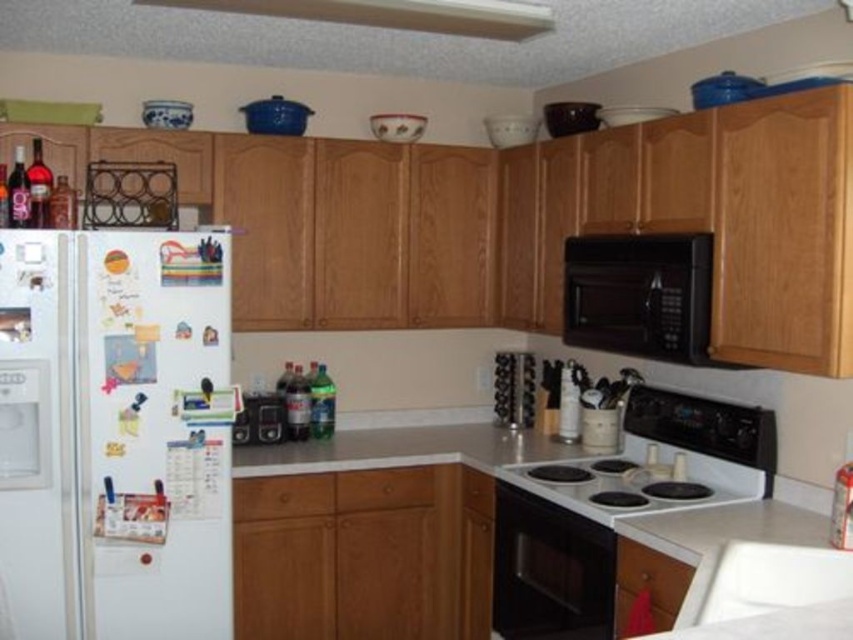
You are trying to install a new microwave above the white matte exhaust hood at upper center and the brushed metal toaster at left. Which object requires a higher mounting height due to its greater height?

The brushed metal toaster at left requires a higher mounting height because it has a greater height than the white matte exhaust hood at upper center.

You are a delivery person who needs to place a new microwave in the kitchen. The current microwave is located at point (639, 294). Where should you place the new microwave to avoid blocking the refrigerator door?

The current microwave is located at point (639, 294), which is the black matte microwave at upper center. To avoid blocking the refrigerator door, you should place the new microwave elsewhere in the kitchen, such as on a different countertop or above another cabinet.